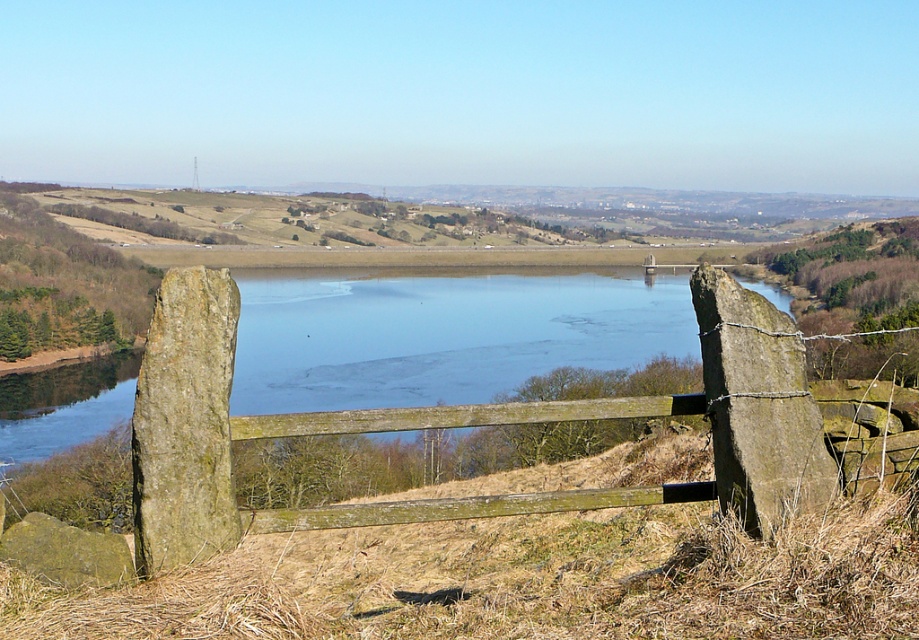
What do you see at coordinates (407, 356) in the screenshot?
I see `wooden gate at center` at bounding box center [407, 356].

In the scene shown: Does wooden gate at center appear over rough textured stone at lower left?

Yes, wooden gate at center is above rough textured stone at lower left.

Does point (549, 362) come in front of point (70, 557)?

No, (549, 362) is behind (70, 557).

Find the location of a particular element. Image resolution: width=919 pixels, height=640 pixels. wooden gate at center is located at coordinates 407,356.

Is green rough stone at left thinner than rough textured stone at lower left?

No.

Who is more forward, (153, 353) or (91, 577)?

Positioned in front is point (153, 353).

Measure the distance between green rough stone at left and camera.

The distance of green rough stone at left from camera is 14.91 feet.

This screenshot has width=919, height=640. I want to click on green rough stone at left, so click(x=184, y=422).

Between wooden gate at center and green rough stone at left, which one has less height?

With less height is green rough stone at left.

Identify the location of wooden gate at center. (407, 356).